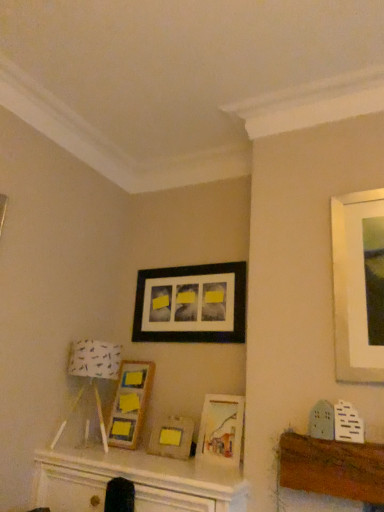
Locate an element on the screen. vacant region above wooden frame at center, the second picture frame positioned from the top (from a real-world perspective) is located at coordinates (143, 353).